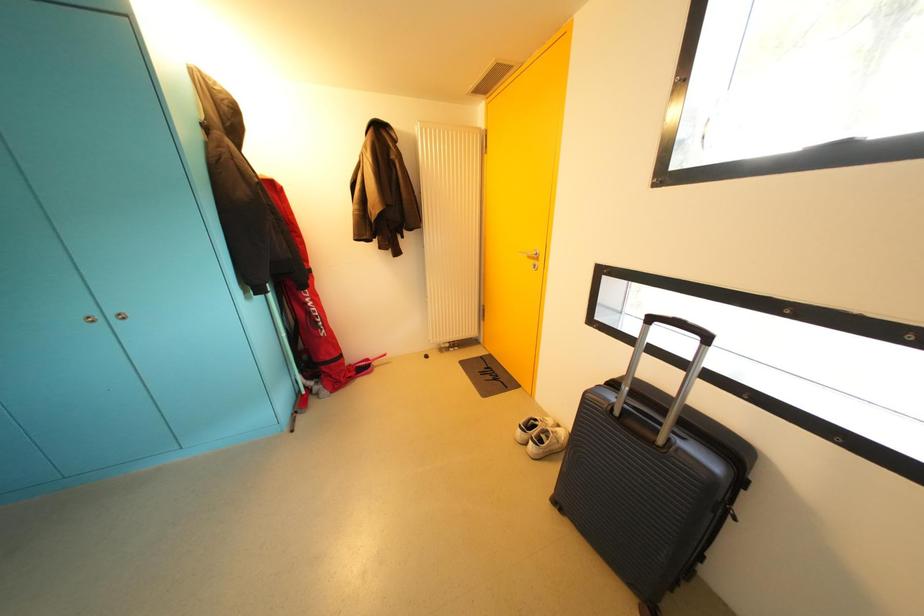
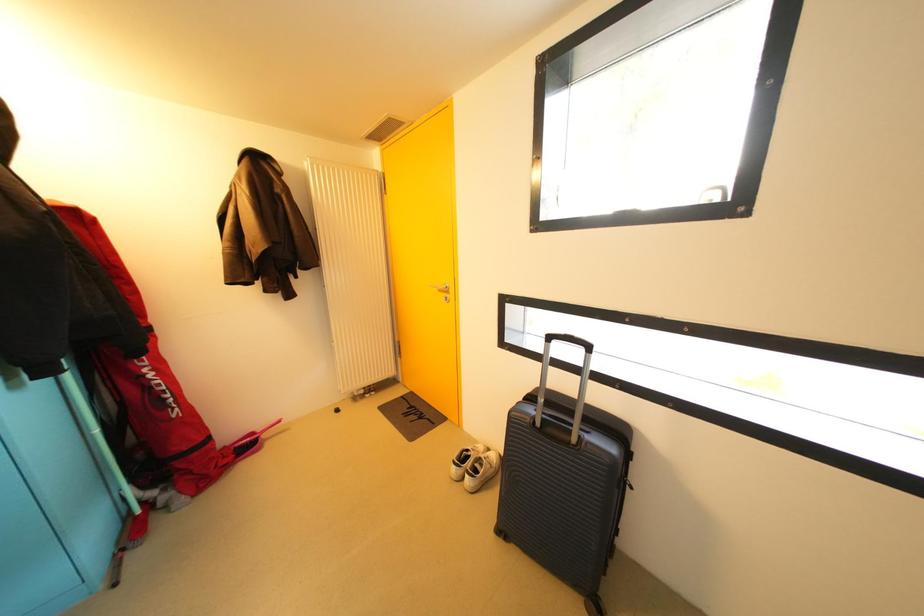
Question: The images are taken continuously from a first-person perspective. In which direction are you moving?

Choices:
 (A) Left
 (B) Right
 (C) Forward
 (D) Backward

Answer: (A)